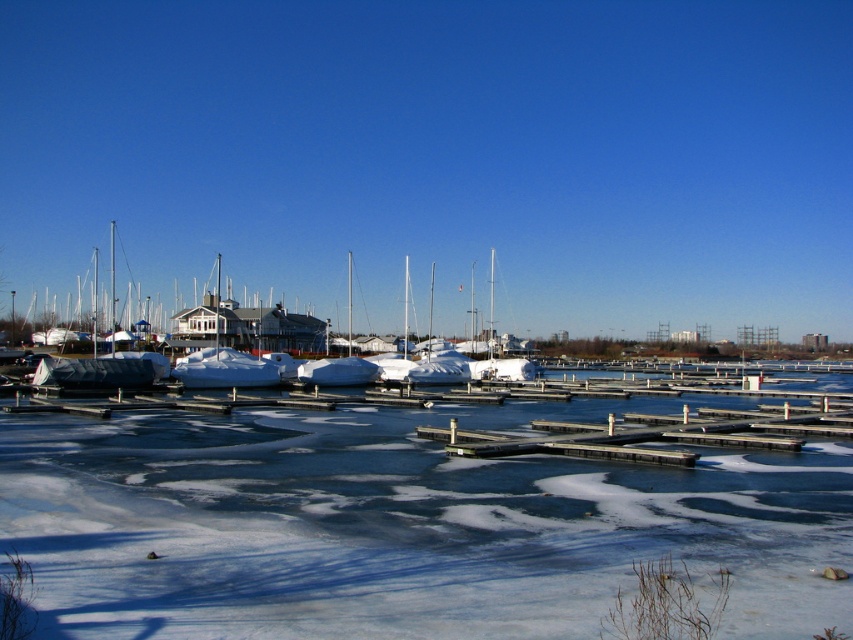
Who is positioned more to the right, white ice at lower center or white matte boat at center?

From the viewer's perspective, white ice at lower center appears more on the right side.

Is white ice at lower center wider than white matte boat at center?

Incorrect, white ice at lower center's width does not surpass white matte boat at center's.

Identify the location of white ice at lower center. (402, 524).